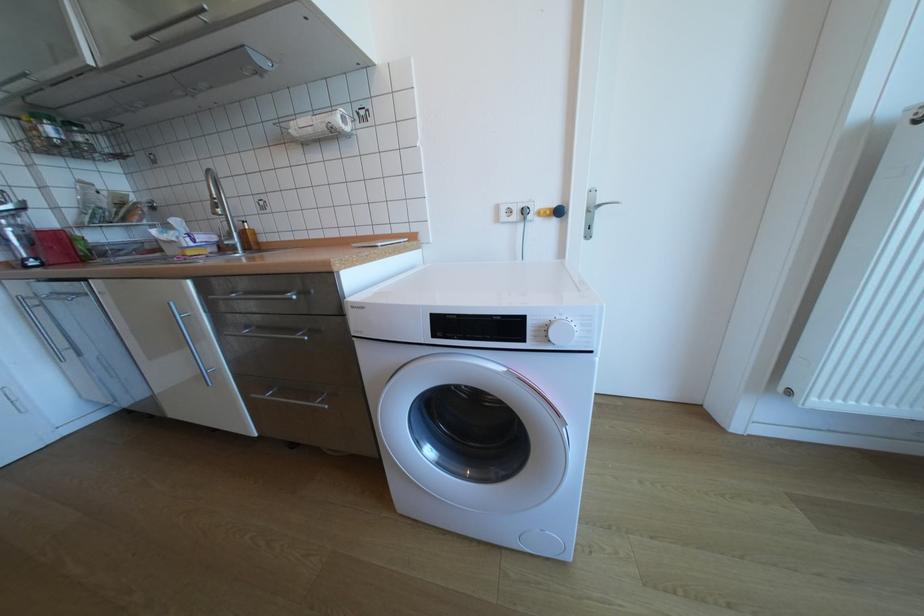
Locate an element on the screen. The width and height of the screenshot is (924, 616). upper cabinet handle is located at coordinates tap(171, 23).